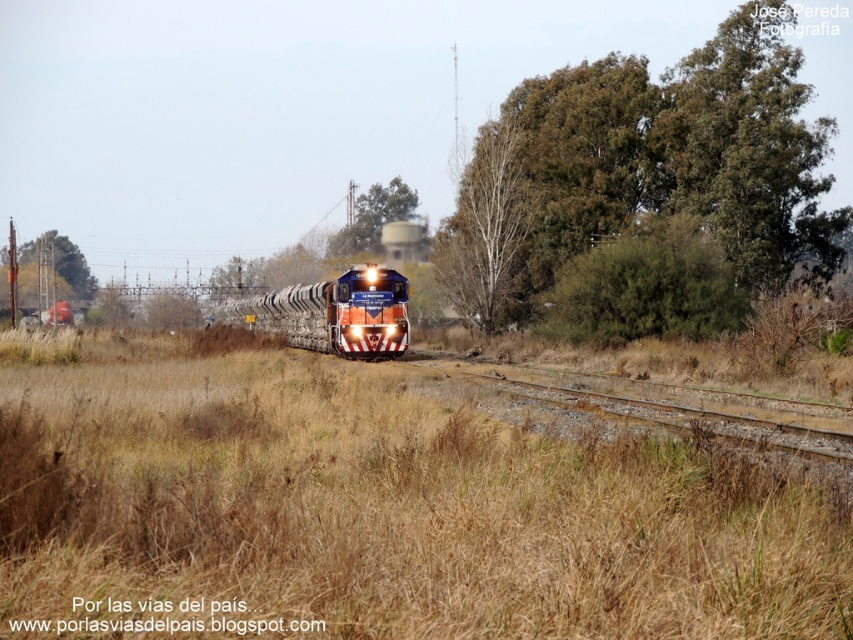
Which is in front, point (737, 280) or point (404, 324)?

Positioned in front is point (404, 324).

Which of these two, green leafy tree at upper right or blue glossy locomotive at center, stands taller?

With more height is green leafy tree at upper right.

This screenshot has height=640, width=853. Identify the location of green leafy tree at upper right. (645, 168).

Does green leafy tree at center appear under green leafy tree at upper center?

No.

Which is in front, point (363, 198) or point (78, 262)?

Positioned in front is point (363, 198).

Find the location of a particular element. The image size is (853, 640). green leafy tree at center is located at coordinates (373, 218).

Can you confirm if bare wood tree at center is positioned below green leafy tree at upper center?

Incorrect, bare wood tree at center is not positioned below green leafy tree at upper center.

Does bare wood tree at center appear on the right side of green leafy tree at upper center?

Correct, you'll find bare wood tree at center to the right of green leafy tree at upper center.

Where is `bare wood tree at center`? The width and height of the screenshot is (853, 640). bare wood tree at center is located at coordinates (485, 225).